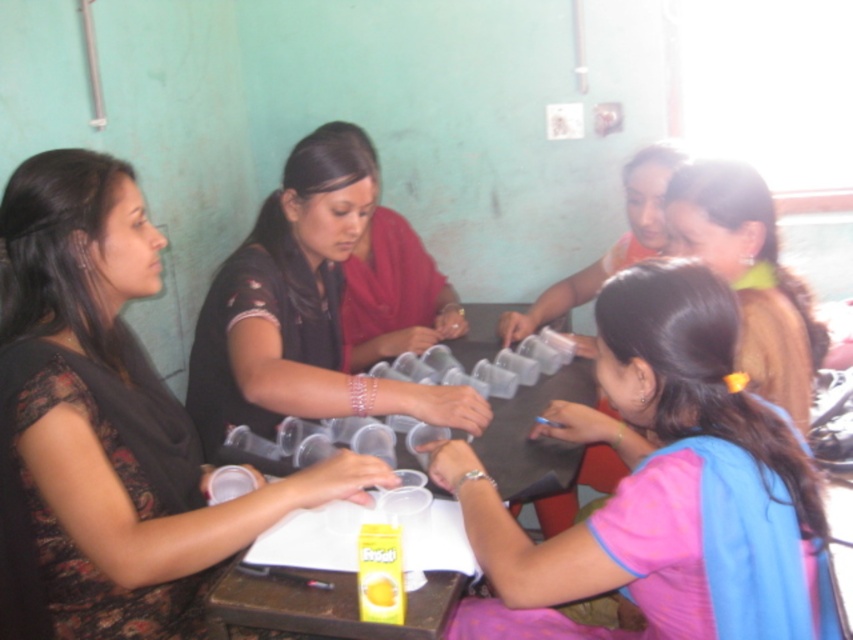
Looking at the group of people around the table, where is the black matte shirt at center in relation to the brown fabric hair tie at upper right?

The black matte shirt at center is positioned to the left of the brown fabric hair tie at upper right.

You are a photographer setting up for a group photo. You need to ensure that the black matte shirt at center and the brown fabric hair tie at upper right are both visible in the frame. Based on their sizes, which object might require you to adjust your camera angle to include it properly?

The black matte shirt at center is much taller than the brown fabric hair tie at upper right, so you might need to adjust the camera angle to ensure the taller black matte shirt at center is fully captured in the frame.